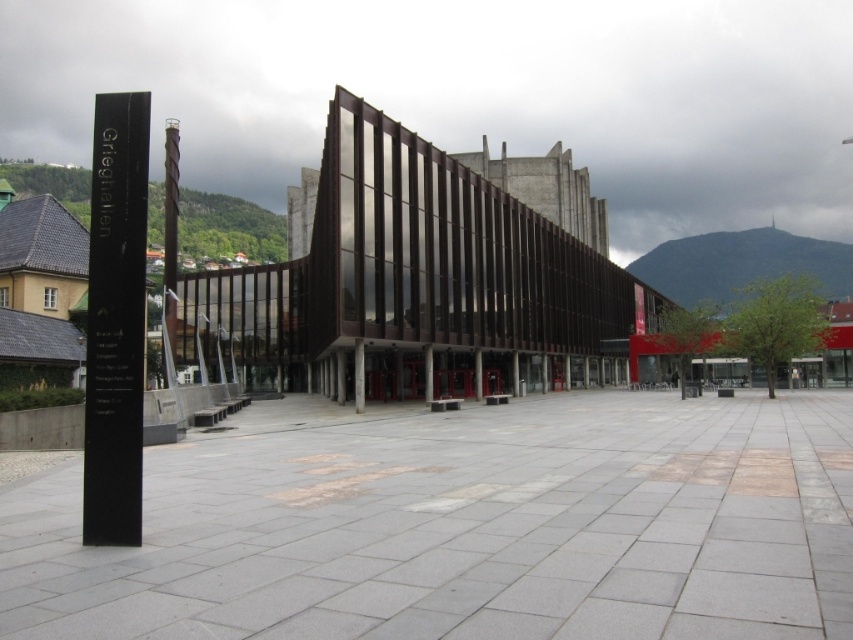
You are standing in front of Grieghallen and notice two poles on the left side. Which pole is closer to the center of the plaza, the black polished stone pole at left or the dark brown polished wood pole at left?

The black polished stone pole at left is positioned on the right side of dark brown polished wood pole at left, so the dark brown polished wood pole at left is closer to the center of the plaza.

Looking at this image, you are a city planner assessing the Grieghallen plaza. You need to install a new bench that is 1.2 meters wide between the black polished stone pole at left and the dark brown polished wood pole at left. Can the space between them accommodate the bench?

The black polished stone pole at left has a lesser width compared to dark brown polished wood pole at left. However, the question is about the space between the two poles, not their widths. Since the objects description only provides information about their widths and not the distance between them, it is impossible to determine if the bench will fit based on the given information.